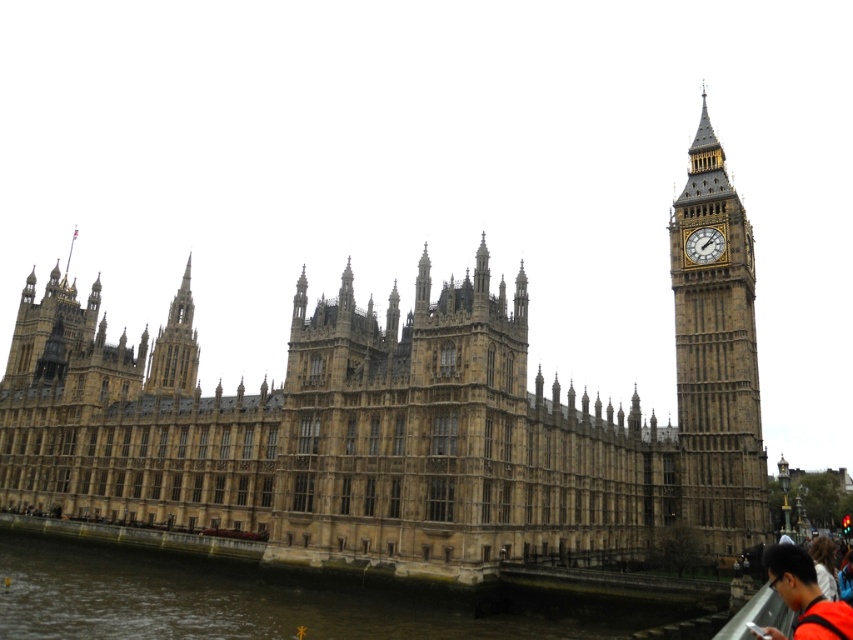
You are a tourist standing in front of the Palace of Westminster. You notice the golden stone spire at upper left and the gold metallic clock at right. Which object appears taller in the image?

The golden stone spire at upper left appears taller than the gold metallic clock at right.

You are standing in front of the Palace of Westminster and Big Ben. You notice a brown stone castle at center and an orange fabric shirt at lower right. Which object is positioned to the left of the other?

The brown stone castle at center is positioned to the left of the orange fabric shirt at lower right.

You are a tourist standing at point (x=409, y=422) in the image. What architectural structure do you see directly in front of you?

The brown stone castle at center is located at point (x=409, y=422), so you see the brown stone castle at center directly in front of you.